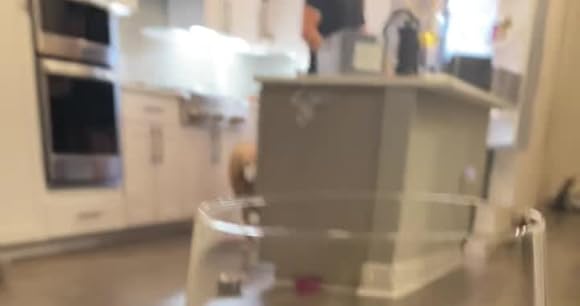
Where is `kitchen island`? Image resolution: width=580 pixels, height=306 pixels. kitchen island is located at coordinates (346, 109).